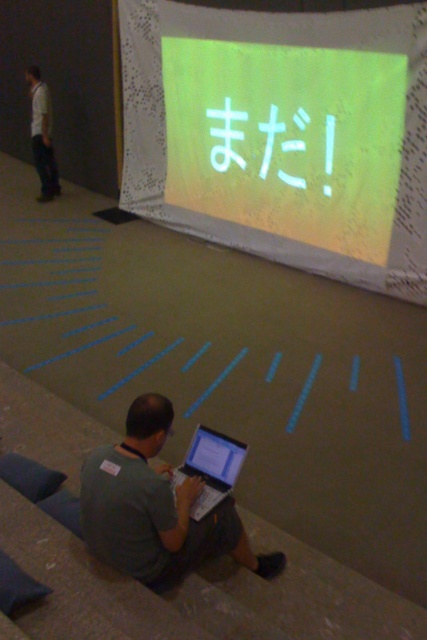
Measure the distance between green matte laptop at lower center and white matte text at upper center.

A distance of 3.59 meters exists between green matte laptop at lower center and white matte text at upper center.

Is green matte laptop at lower center behind white matte text at upper center?

No, green matte laptop at lower center is in front of white matte text at upper center.

Which is behind, point (219, 518) or point (236, 154)?

The point (236, 154) is behind.

The width and height of the screenshot is (427, 640). In order to click on green matte laptop at lower center in this screenshot , I will do `click(155, 508)`.

Does matte yellow fabric at upper center appear on the left side of light gray shirt at left?

No, matte yellow fabric at upper center is not to the left of light gray shirt at left.

Measure the distance between point (245, 227) and camera.

The distance of point (245, 227) from camera is 5.71 meters.

The height and width of the screenshot is (640, 427). Identify the location of matte yellow fabric at upper center. (281, 134).

Is green matte laptop at lower center taller than matte silver laptop at lower center?

Indeed, green matte laptop at lower center has a greater height compared to matte silver laptop at lower center.

Is point (134, 458) less distant than point (215, 433)?

Yes, point (134, 458) is closer to viewer.

Locate an element on the screen. green matte laptop at lower center is located at coordinates pos(155,508).